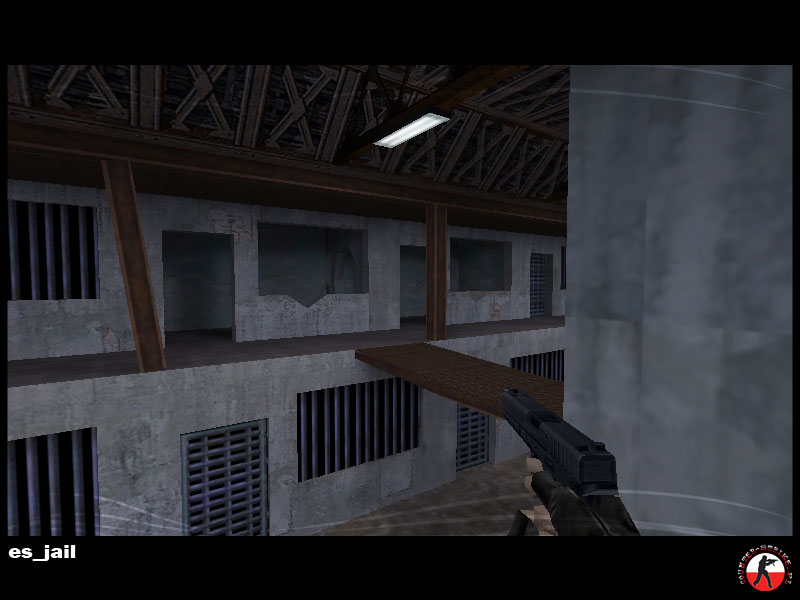
Find the location of a particular element. The image size is (800, 600). open windows is located at coordinates (306, 281), (474, 274).